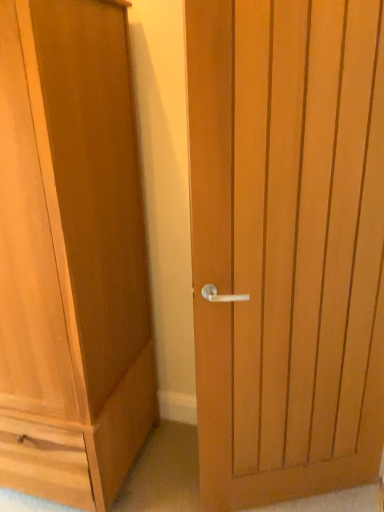
Question: From a real-world perspective, is light brown wood door at center positioned above or below light brown wood cupboard at left?

Choices:
 (A) below
 (B) above

Answer: (A)

Question: Visually, is light brown wood door at center positioned to the left or to the right of light brown wood cupboard at left?

Choices:
 (A) right
 (B) left

Answer: (A)

Question: In terms of width, does light brown wood door at center look wider or thinner when compared to light brown wood cupboard at left?

Choices:
 (A) thin
 (B) wide

Answer: (A)

Question: Is light brown wood cupboard at left inside or outside of light brown wood door at center?

Choices:
 (A) outside
 (B) inside

Answer: (A)

Question: Visually, is light brown wood cupboard at left positioned to the left or to the right of light brown wood door at center?

Choices:
 (A) left
 (B) right

Answer: (A)

Question: Considering the positions of light brown wood cupboard at left and light brown wood door at center in the image, is light brown wood cupboard at left wider or thinner than light brown wood door at center?

Choices:
 (A) thin
 (B) wide

Answer: (B)

Question: In terms of height, does light brown wood cupboard at left look taller or shorter compared to light brown wood door at center?

Choices:
 (A) tall
 (B) short

Answer: (A)